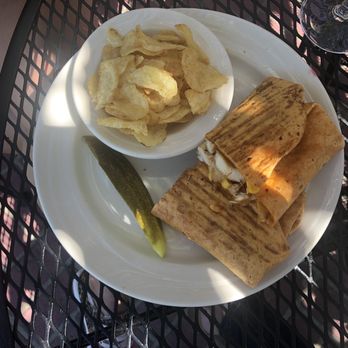
The width and height of the screenshot is (348, 348). What are the coordinates of `black table` in the screenshot? It's located at (197, 327).